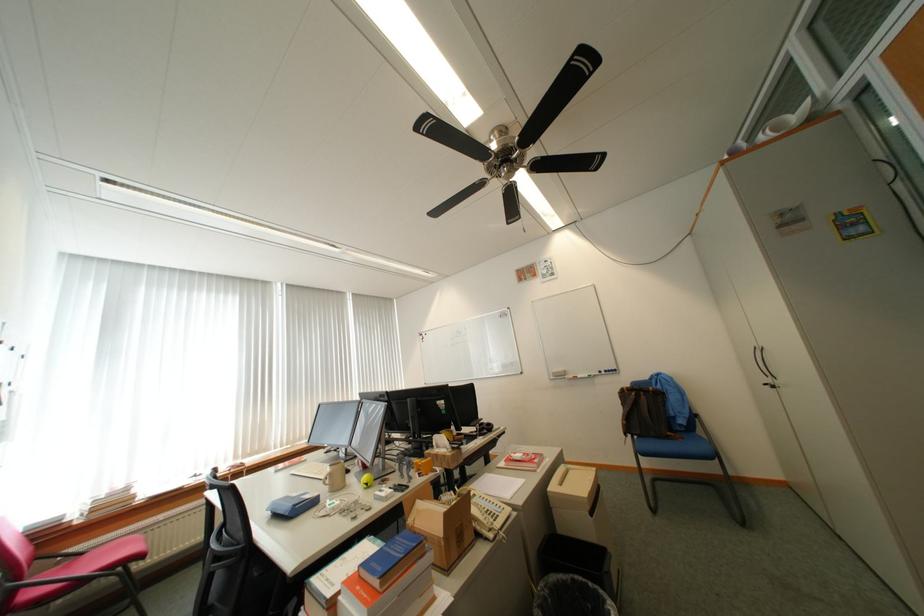
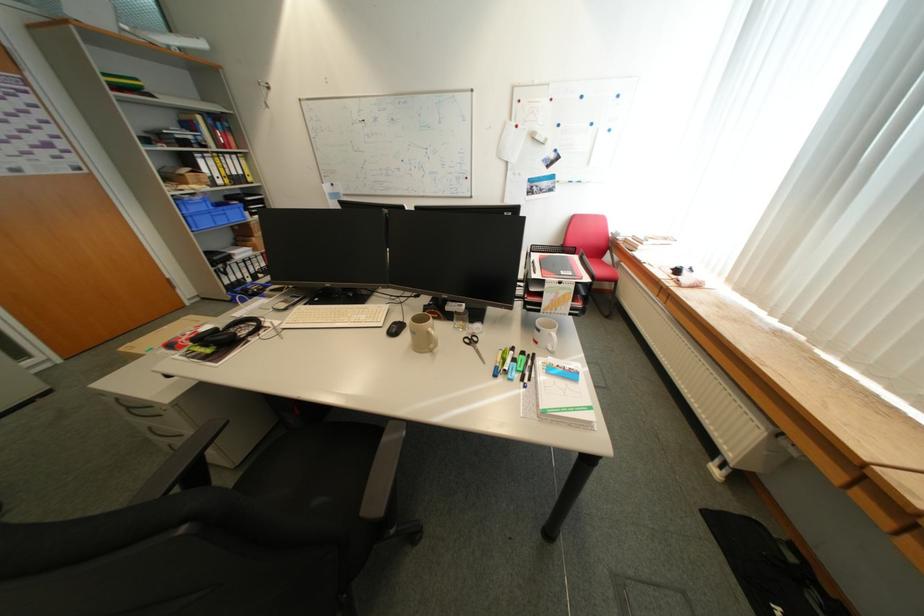
Question: I am providing you with two images of the same scene from different viewpoints. Please identify which objects are invisible in image2.

Choices:
 (A) silver drawer pull
 (B) beige coffee mug
 (C) black chair armrest
 (D) black marker

Answer: (C)